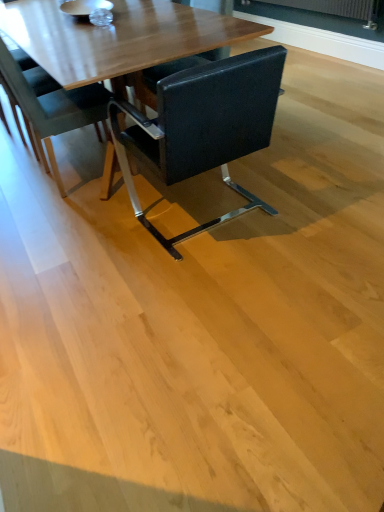
Question: Does point (39, 135) appear closer or farther from the camera than point (259, 96)?

Choices:
 (A) closer
 (B) farther

Answer: (B)

Question: Is black leather chair at center, arranged as the 2th chair when viewed from the right, to the left or to the right of black leather chair at center, the second chair in the left-to-right sequence, in the image?

Choices:
 (A) right
 (B) left

Answer: (B)

Question: Considering the positions of black leather chair at center, arranged as the 2th chair when viewed from the right, and black leather chair at center, arranged as the 1th chair when viewed from the right, in the image, is black leather chair at center, arranged as the 2th chair when viewed from the right, bigger or smaller than black leather chair at center, arranged as the 1th chair when viewed from the right,?

Choices:
 (A) small
 (B) big

Answer: (A)

Question: Is point (220, 67) positioned closer to the camera than point (51, 169)?

Choices:
 (A) farther
 (B) closer

Answer: (B)

Question: Would you say black leather chair at center, the second chair in the left-to-right sequence, is to the left or to the right of black leather chair at center, arranged as the 2th chair when viewed from the right, in the picture?

Choices:
 (A) left
 (B) right

Answer: (B)

Question: Is black leather chair at center, the second chair in the left-to-right sequence, taller or shorter than black leather chair at center, the 1th chair viewed from the left?

Choices:
 (A) tall
 (B) short

Answer: (B)

Question: From the image's perspective, relative to black leather chair at center, arranged as the 2th chair when viewed from the right, is black leather chair at center, the second chair in the left-to-right sequence, above or below?

Choices:
 (A) below
 (B) above

Answer: (A)